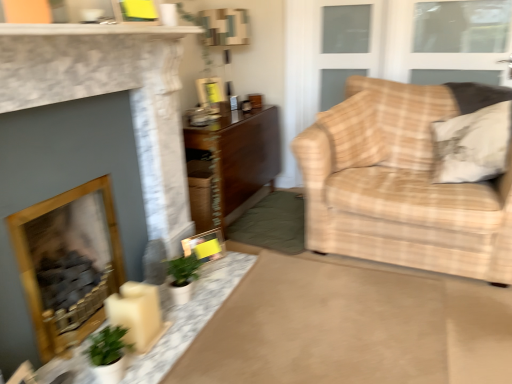
Question: Is yellow paper picture frame at center, the 2th picture frame positioned from the top, bigger or smaller than white textured pillow at right?

Choices:
 (A) small
 (B) big

Answer: (A)

Question: In terms of width, does yellow paper picture frame at center, the first picture frame from the front, look wider or thinner when compared to white textured pillow at right?

Choices:
 (A) thin
 (B) wide

Answer: (A)

Question: Considering the real-world distances, which object is farthest from the wooden fireplace at left, the first fireplace positioned from the back?

Choices:
 (A) clear glass window at upper right, which appears as the first window when ordered from the bottom
 (B) white textured pillow at right
 (C) matte plastic picture frame at upper center, positioned as the 1th picture frame in back-to-front order
 (D) transparent glass window at upper right, placed as the second window when sorted from bottom to top
 (E) matte stone fireplace at left, the 1th fireplace when ordered from front to back

Answer: (D)

Question: Which object is positioned farthest from the yellow paper picture frame at center, the 2th picture frame positioned from the top?

Choices:
 (A) white marble mantle at upper center
 (B) matte stone fireplace at left, the 1th fireplace when ordered from front to back
 (C) white marble table at center, the 1th table when ordered from bottom to top
 (D) white textured pillow at right
 (E) beige plaid fabric couch at right

Answer: (D)